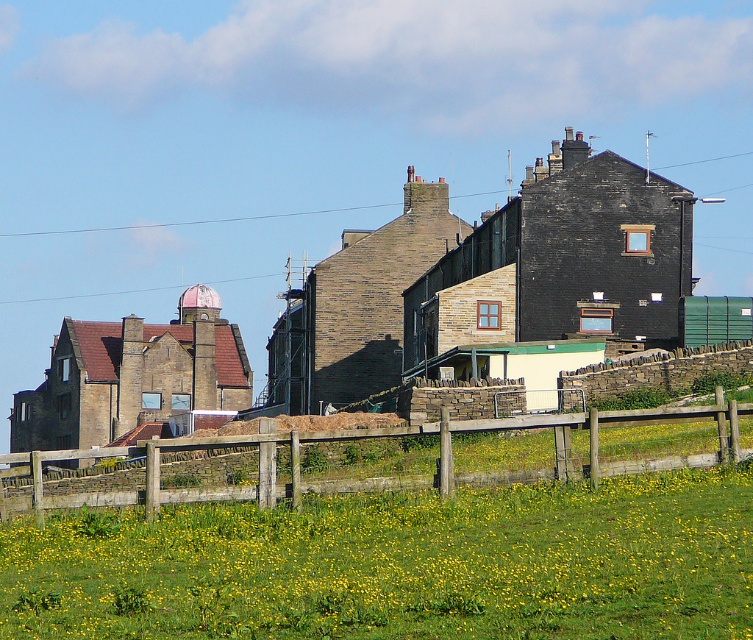
Question: Which object is closer to the camera taking this photo?

Choices:
 (A) green grassy field at lower center
 (B) wooden fence at lower center

Answer: (A)

Question: Which object appears farthest from the camera in this image?

Choices:
 (A) green grassy field at lower center
 (B) wooden fence at lower center

Answer: (B)

Question: Considering the relative positions of green grassy field at lower center and wooden fence at lower center in the image provided, where is green grassy field at lower center located with respect to wooden fence at lower center?

Choices:
 (A) below
 (B) above

Answer: (A)

Question: Is green grassy field at lower center positioned in front of wooden fence at lower center?

Choices:
 (A) no
 (B) yes

Answer: (B)

Question: Which object appears farthest from the camera in this image?

Choices:
 (A) wooden fence at lower center
 (B) green grassy field at lower center

Answer: (A)

Question: Is green grassy field at lower center to the left of wooden fence at lower center from the viewer's perspective?

Choices:
 (A) no
 (B) yes

Answer: (B)